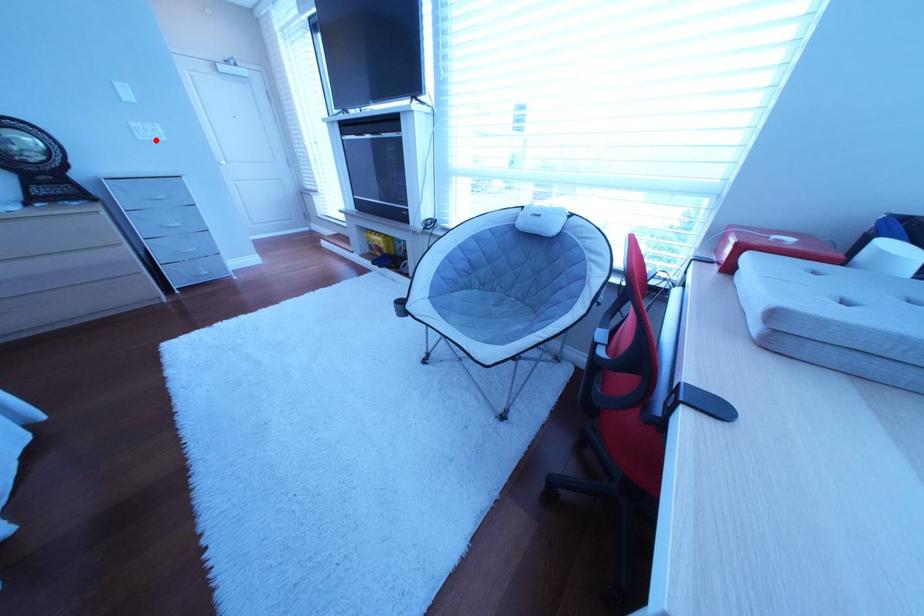
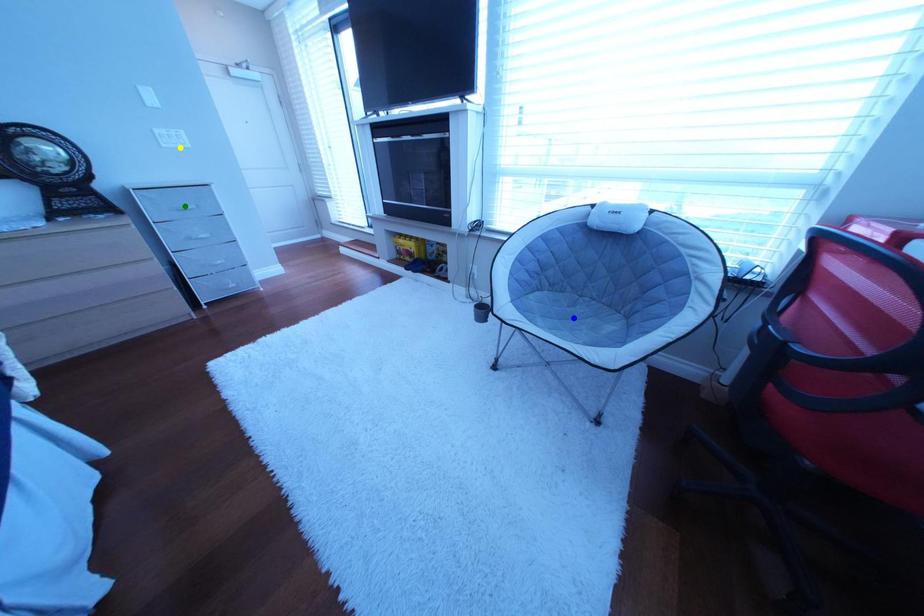
Question: I am providing you with two images of the same scene from different viewpoints. A red point is marked on the first image. You are given multiple points on the second image. Which point in image 2 represents the same 3d spot as the red point in image 1?

Choices:
 (A) yellow point
 (B) green point
 (C) blue point

Answer: (A)